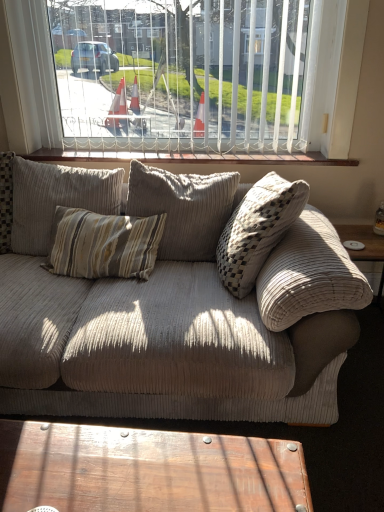
Question: From their relative heights in the image, would you say white vertical blinds at upper center is taller or shorter than wooden polished coffee table at lower center?

Choices:
 (A) short
 (B) tall

Answer: (B)

Question: Is white vertical blinds at upper center inside the boundaries of wooden polished coffee table at lower center, or outside?

Choices:
 (A) outside
 (B) inside

Answer: (A)

Question: Estimate the real-world distances between objects in this image. Which object is closer to the wooden at upper center?

Choices:
 (A) white vertical blinds at upper center
 (B) beige corduroy pillow at center, marked as the 2th pillow in a right-to-left arrangement
 (C) corduroy pillow at center, the first pillow positioned from the right
 (D) wooden polished coffee table at lower center
 (E) beige corduroy couch at center

Answer: (B)

Question: Based on their relative distances, which object is farther from the beige corduroy pillow at center, marked as the 2th pillow in a right-to-left arrangement?

Choices:
 (A) wooden at upper center
 (B) beige corduroy couch at center
 (C) white vertical blinds at upper center
 (D) wooden polished coffee table at lower center
 (E) corduroy pillow at center, the first pillow positioned from the right

Answer: (D)